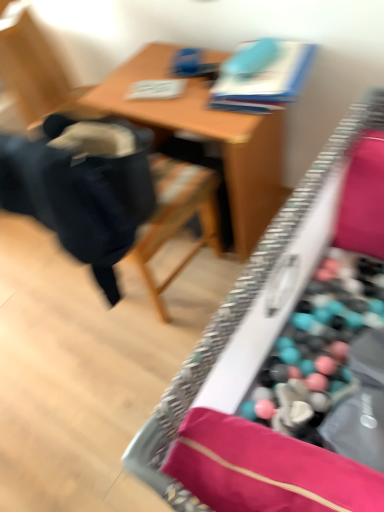
The image size is (384, 512). Identify the location of vacant region in front of black fabric chair at left. (133, 372).